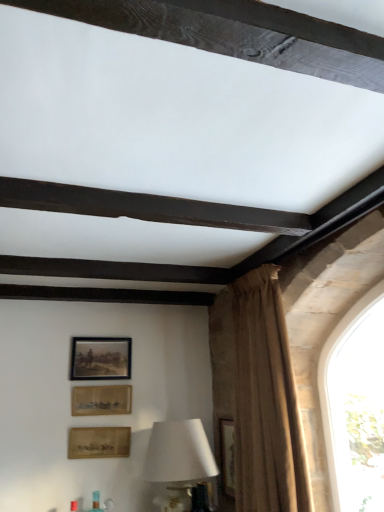
Question: Is wooden framed picture at lower center, the third picture frame viewed from the top, oriented towards white matte table lamp at lower center?

Choices:
 (A) no
 (B) yes

Answer: (A)

Question: Are wooden framed picture at lower center, which is counted as the 1th picture frame, starting from the bottom, and white matte table lamp at lower center beside each other?

Choices:
 (A) no
 (B) yes

Answer: (A)

Question: Considering the relative sizes of wooden framed picture at lower center, the third picture frame viewed from the top, and white matte table lamp at lower center in the image provided, is wooden framed picture at lower center, the third picture frame viewed from the top, wider than white matte table lamp at lower center?

Choices:
 (A) yes
 (B) no

Answer: (B)

Question: From a real-world perspective, is wooden framed picture at lower center, the third picture frame viewed from the top, positioned under white matte table lamp at lower center based on gravity?

Choices:
 (A) yes
 (B) no

Answer: (B)

Question: From a real-world perspective, is wooden framed picture at lower center, which is counted as the 1th picture frame, starting from the bottom, on white matte table lamp at lower center?

Choices:
 (A) yes
 (B) no

Answer: (A)

Question: Is wooden framed picture at lower center, the third picture frame viewed from the top, to the left of white matte table lamp at lower center from the viewer's perspective?

Choices:
 (A) no
 (B) yes

Answer: (B)

Question: From a real-world perspective, is white matte table lamp at lower center on wooden textured picture frame at lower center, placed as the second picture frame when sorted from bottom to top?

Choices:
 (A) no
 (B) yes

Answer: (A)

Question: From a real-world perspective, is white matte table lamp at lower center beneath wooden textured picture frame at lower center, the second picture frame in the top-to-bottom sequence?

Choices:
 (A) no
 (B) yes

Answer: (B)

Question: From the image's perspective, is white matte table lamp at lower center beneath wooden textured picture frame at lower center, placed as the second picture frame when sorted from bottom to top?

Choices:
 (A) no
 (B) yes

Answer: (B)

Question: Is white matte table lamp at lower center turned away from wooden textured picture frame at lower center, the second picture frame in the top-to-bottom sequence?

Choices:
 (A) yes
 (B) no

Answer: (B)

Question: Considering the relative positions of white matte table lamp at lower center and wooden textured picture frame at lower center, the second picture frame in the top-to-bottom sequence, in the image provided, is white matte table lamp at lower center to the left of wooden textured picture frame at lower center, the second picture frame in the top-to-bottom sequence, from the viewer's perspective?

Choices:
 (A) no
 (B) yes

Answer: (A)

Question: Is white matte table lamp at lower center wider than wooden textured picture frame at lower center, the second picture frame in the top-to-bottom sequence?

Choices:
 (A) no
 (B) yes

Answer: (B)

Question: From the image's perspective, is brown textured curtain at right beneath wooden frame at upper center, which is counted as the 1th picture frame, starting from the top?

Choices:
 (A) yes
 (B) no

Answer: (A)